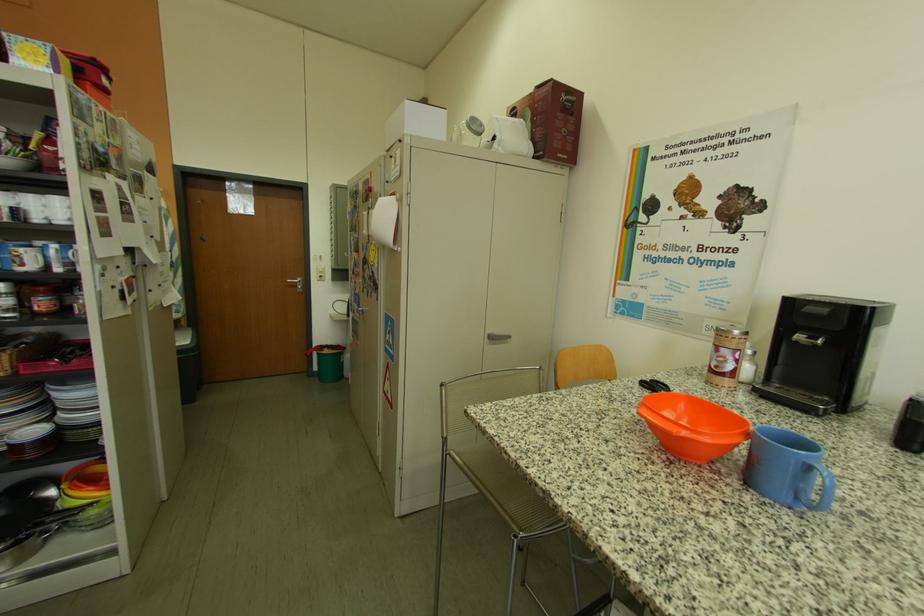
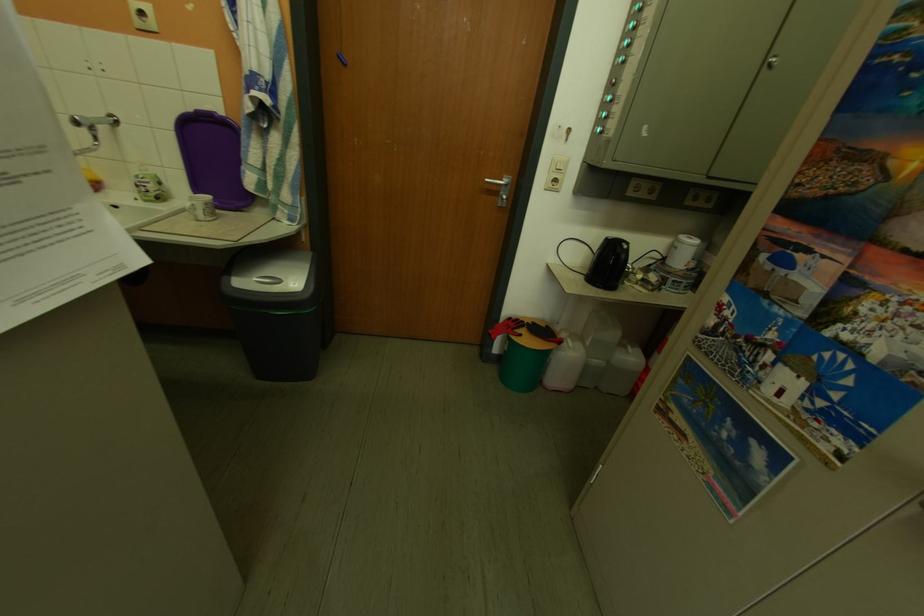
Find the pixel in the second image that matches (357,351) in the first image.

(574, 345)